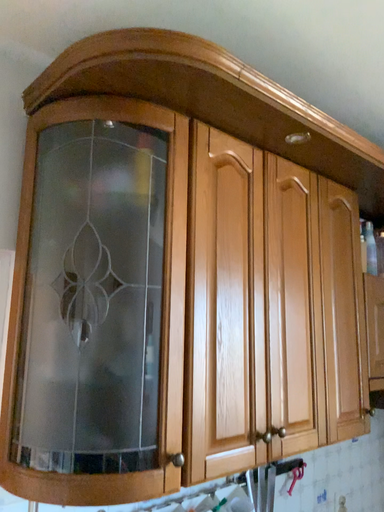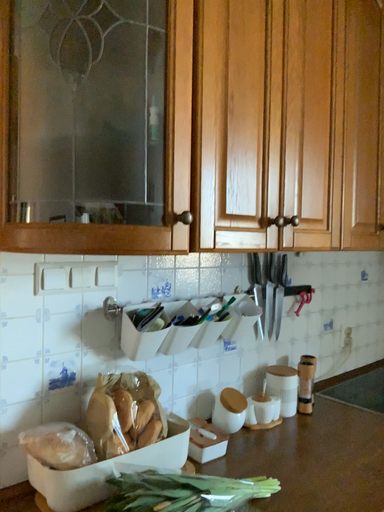
Question: How did the camera likely rotate when shooting the video?

Choices:
 (A) rotated downward
 (B) rotated upward

Answer: (A)